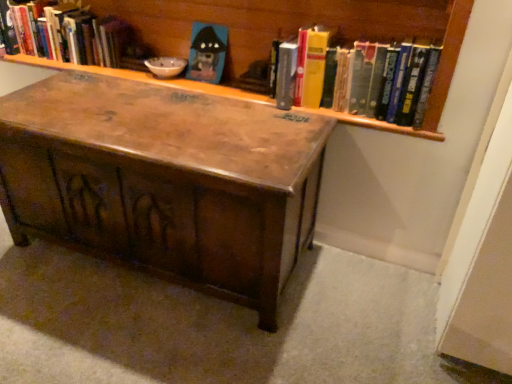
Question: Is point (190, 66) positioned closer to the camera than point (428, 72)?

Choices:
 (A) farther
 (B) closer

Answer: (A)

Question: From the image's perspective, relative to hardcover books at upper right, which is the 2th book from left to right, is matte plastic toy at upper center above or below?

Choices:
 (A) below
 (B) above

Answer: (B)

Question: Estimate the real-world distances between objects in this image. Which object is farther from the hardcover book at upper left, positioned as the 2th book in front-to-back order?

Choices:
 (A) hardcover books at upper right, positioned as the first book in front-to-back order
 (B) matte plastic toy at upper center
 (C) wooden trunk at center
 (D) wooden bookcase at upper center

Answer: (A)

Question: Estimate the real-world distances between objects in this image. Which object is farther from the wooden bookcase at upper center?

Choices:
 (A) matte plastic toy at upper center
 (B) hardcover books at upper right, which is the 2th book from left to right
 (C) wooden trunk at center
 (D) hardcover book at upper left, the 2th book viewed from the right

Answer: (C)